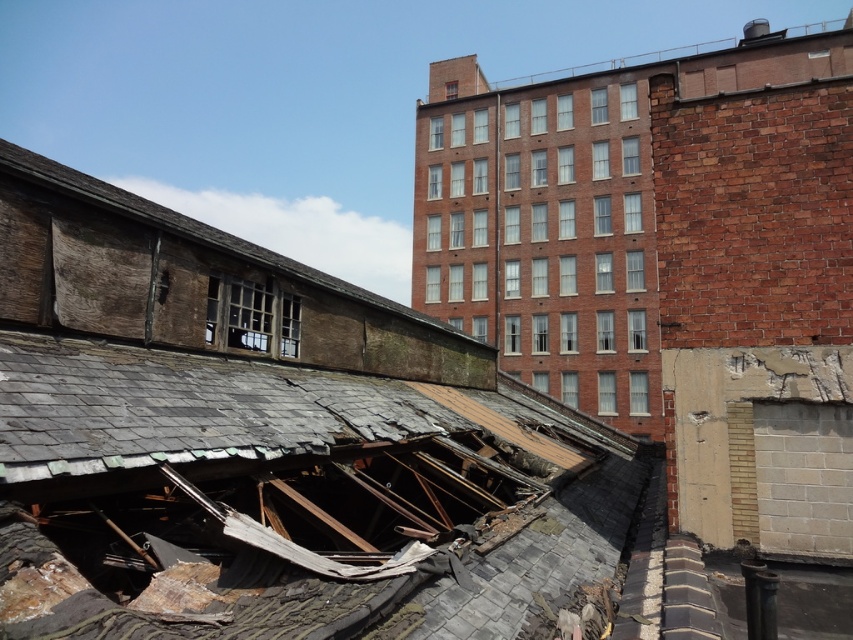
You are an architect assessing the structural integrity of the buildings in the image. You notice the weathered wood at upper left and the smooth brick roof at upper center. Which of these two elements has a narrower width?

The weathered wood at upper left has a narrower width than the smooth brick roof at upper center.

You are an architect inspecting two buildings. You notice the weathered wood at upper left and the smooth brick roof at upper center. Which of these two objects is located to the left of the other?

The weathered wood at upper left is positioned on the left side of the smooth brick roof at upper center.

You are standing at the point marked as point (199, 230) in the image. What type of material are you currently touching?

→ The point (199, 230) corresponds to the weathered wood at upper left, so you are touching weathered wood.